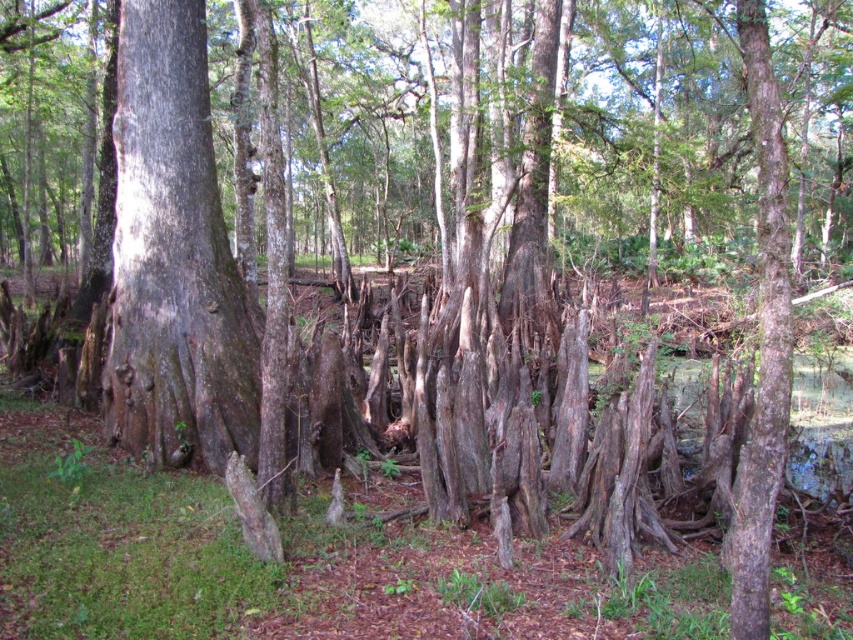
You are a hiker navigating through this forest and need to find your way to the right side. Which direction should you move relative to the smooth gray bark at center to reach the smooth bark tree trunk at right?

The smooth gray bark at center is to the left of the smooth bark tree trunk at right. To reach the smooth bark tree trunk at right, you should move to the right from the smooth gray bark at center.

Looking at this image, you are an ecologist studying tree bark textures in the swamp. You notice two trees in the scene. Which one is farther away from you, the smooth gray bark at center or the smooth bark tree trunk at right?

The smooth bark tree trunk at right is farther away because it is positioned behind the smooth gray bark at center.

You are a hiker navigating through this swamp forest and need to identify landmarks. Which of the two landmarks, the smooth gray bark at center or the smooth bark tree trunk at right, is positioned higher up in the image?

The smooth gray bark at center is located above the smooth bark tree trunk at right in the image.